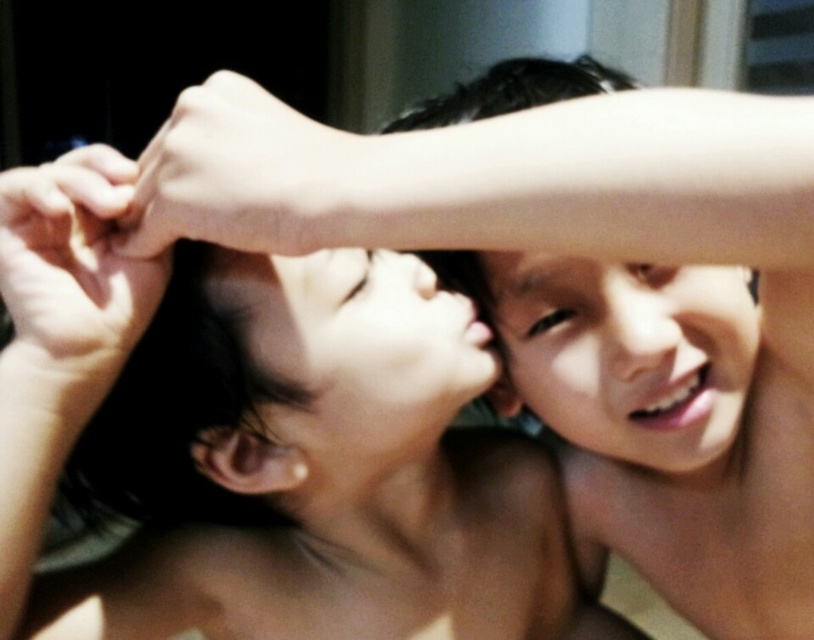
You are an AI analyzing facial positions in images. In the scene described, where is the smooth skin face at upper center located in terms of its 2D coordinates?

The smooth skin face at upper center is located at the 2D coordinates point (627, 355).

You are taking a photo of two people in a dimly lit room. You notice two points in the image at coordinates point (534, 260) and point (427, 282). Which point is closer to the camera?

Point (534, 260) is closer to the camera than point (427, 282).